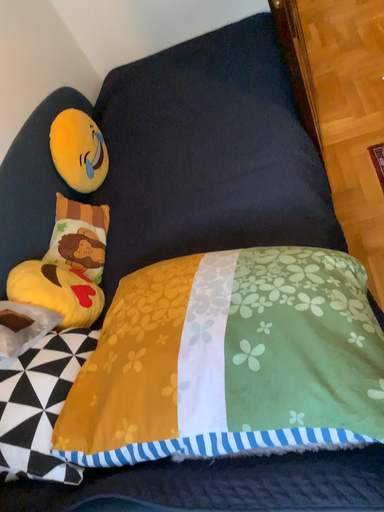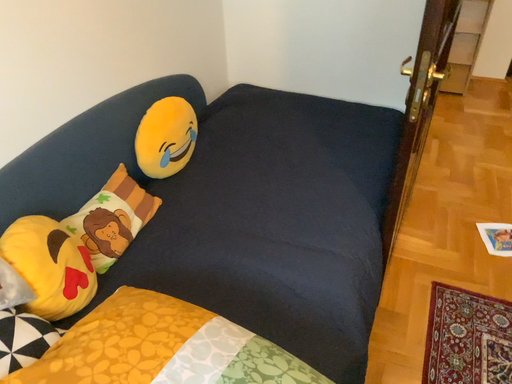
Question: Which way did the camera rotate in the video?

Choices:
 (A) rotated upward
 (B) rotated downward

Answer: (A)